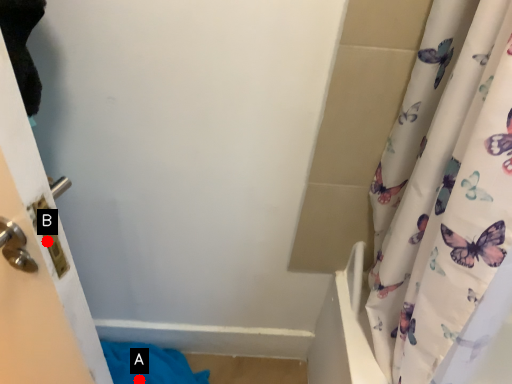
Question: Two points are circled on the image, labeled by A and B beside each circle. Which of the following is the closest to the observer?

Choices:
 (A) A is closer
 (B) B is closer

Answer: (B)